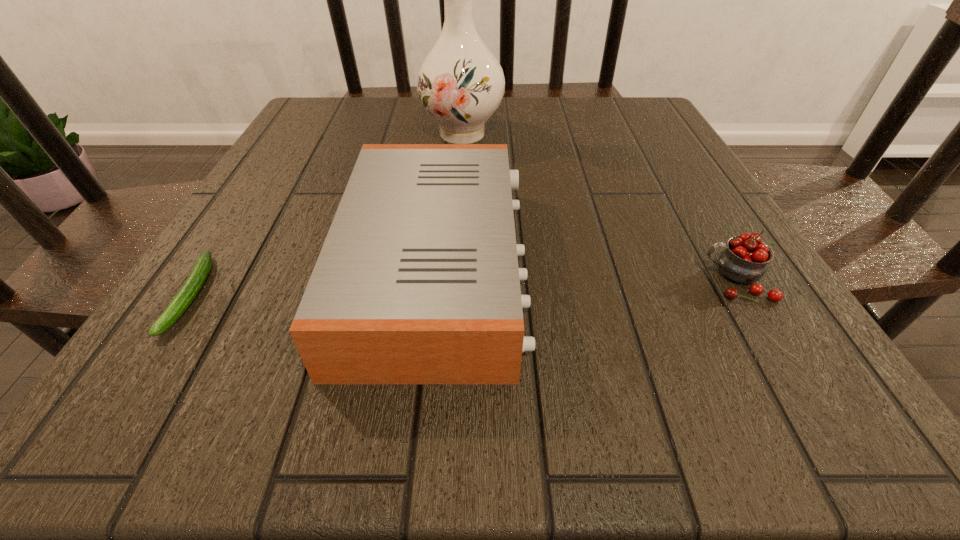
Locate an element on the screen. This screenshot has height=540, width=960. vacant area at the far left corner is located at coordinates (341, 107).

I want to click on vacant region at the near right corner of the desktop, so click(x=717, y=367).

This screenshot has height=540, width=960. I want to click on vacant area between the vase and the rightmost object, so click(599, 207).

The height and width of the screenshot is (540, 960). In order to click on free space between the vase and the rightmost object in this screenshot , I will do `click(599, 207)`.

Find the location of a particular element. This screenshot has height=540, width=960. vacant area between the vase and the rightmost object is located at coordinates (599, 207).

Where is `vacant point located between the tallest object and the cherry`? The width and height of the screenshot is (960, 540). vacant point located between the tallest object and the cherry is located at coordinates (599, 207).

Identify the location of empty space that is in between the radio receiver and the rightmost object. This screenshot has width=960, height=540. (587, 274).

Identify the location of free spot between the tallest object and the zucchini. (326, 214).

Locate which object ranks in proximity to the radio receiver. Please provide its 2D coordinates. Your answer should be formatted as a tuple, i.e. [(x, y)], where the tuple contains the x and y coordinates of a point satisfying the conditions above.

[(460, 83)]

Where is `object that ranks as the second closest to the zucchini`? Image resolution: width=960 pixels, height=540 pixels. object that ranks as the second closest to the zucchini is located at coordinates (460, 83).